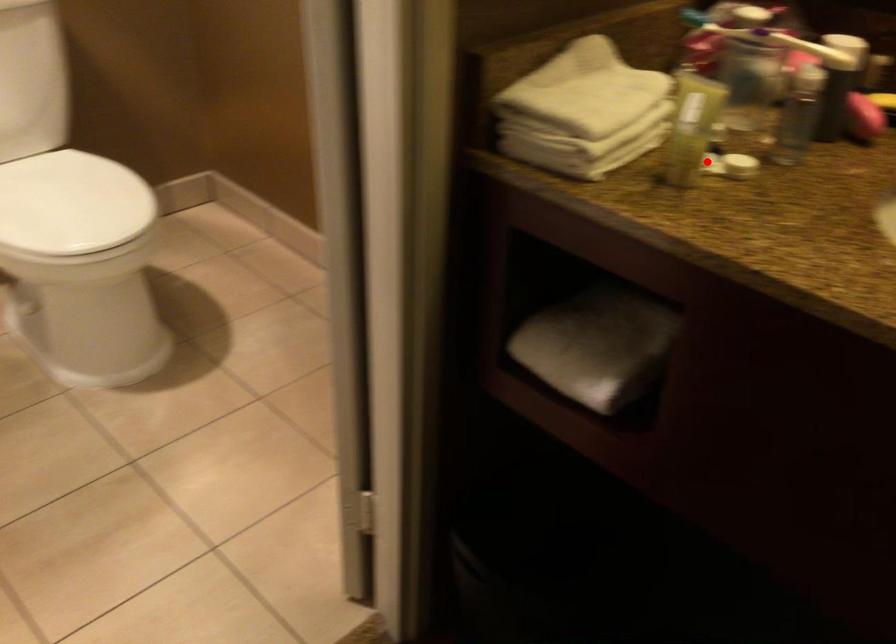
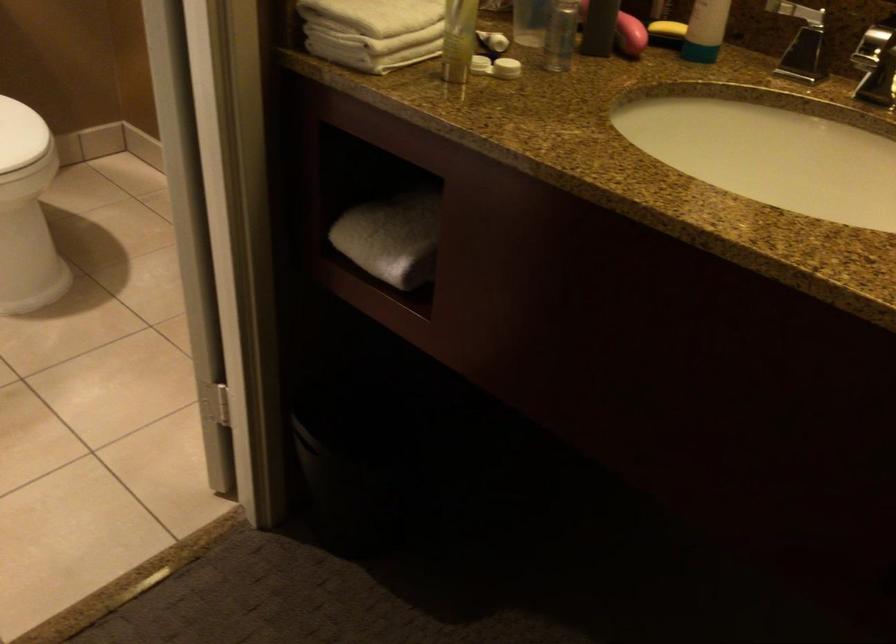
Where in the second image is the point corresponding to the highlighted location from the first image?

(479, 64)